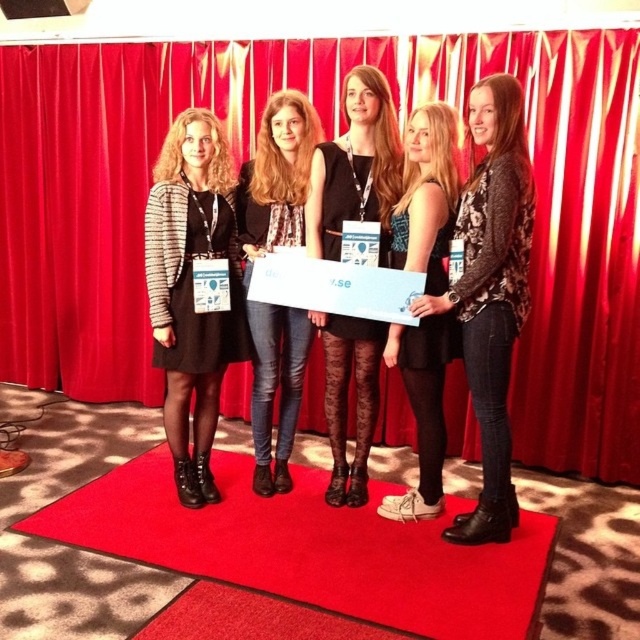
You are a photographer at a formal event. You need to capture a wide shot of the red carpet at center and the matte black jacket at center. Which object will occupy more space in your photo?

The red carpet at center is larger in size than the matte black jacket at center, so it will occupy more space in the photo.